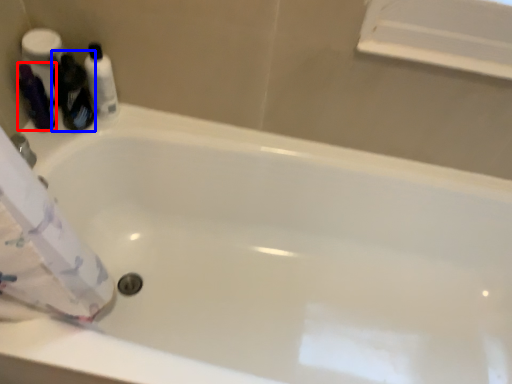
Question: Which object is further to the camera taking this photo, toiletry (highlighted by a red box) or cleaning product (highlighted by a blue box)?

Choices:
 (A) toiletry
 (B) cleaning product

Answer: (A)